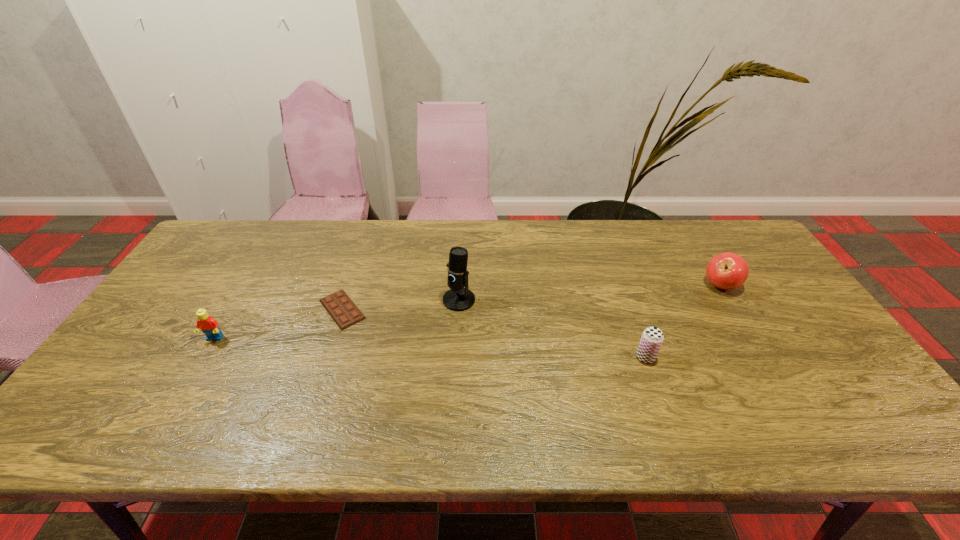
Identify the location of the third object from right to left. (458, 298).

In order to click on microphone in this screenshot , I will do `click(458, 298)`.

Where is `the rightmost object`? The image size is (960, 540). the rightmost object is located at coordinates (727, 270).

The width and height of the screenshot is (960, 540). Find the location of `the fourth farthest object`. the fourth farthest object is located at coordinates (207, 324).

The image size is (960, 540). What are the coordinates of `Lego` in the screenshot? It's located at (207, 324).

Find the location of `the fourth object from left to right`. the fourth object from left to right is located at coordinates (652, 337).

Identify the location of the nearest object. (652, 337).

Find the location of a particular element. This screenshot has height=540, width=960. the shortest object is located at coordinates (341, 308).

Locate an element on the screen. the fourth object from right to left is located at coordinates (341, 308).

The image size is (960, 540). I want to click on free space located on the back of the tallest object, so click(x=462, y=241).